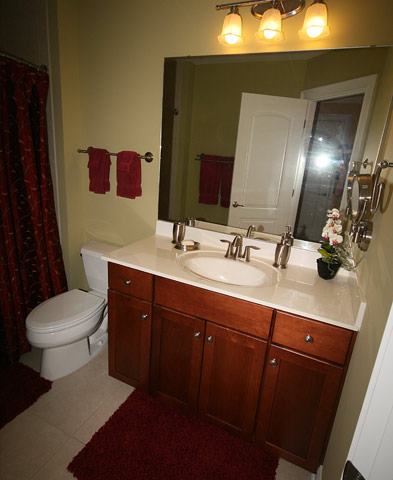
At what (x,y) coordinates should I click in order to perform the action: click on knobs. Please return your answer as a coordinate pair (x, y). Looking at the image, I should click on (197, 336).